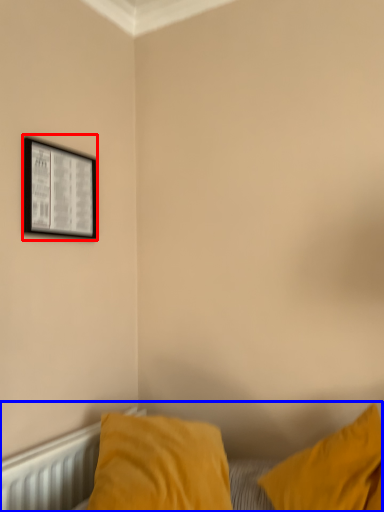
Question: Which object appears closest to the camera in this image, picture frame (highlighted by a red box) or bed (highlighted by a blue box)?

Choices:
 (A) picture frame
 (B) bed

Answer: (B)